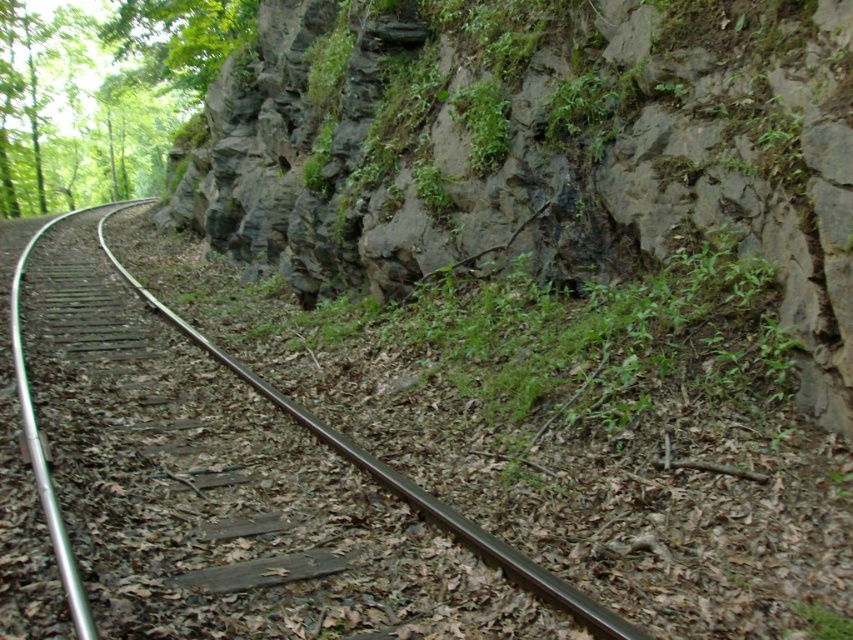
You are a train engineer approaching the rocky cliff at center and the black metal track at left. Which object is positioned higher in elevation?

The rocky cliff at center is located above the black metal track at left, so it has a higher elevation.

You are a hiker who wants to take a photo of the rocky cliff at center. Where exactly should you position yourself to capture it in the frame?

To capture the rocky cliff at center in your photo, position yourself at point (543, 154).